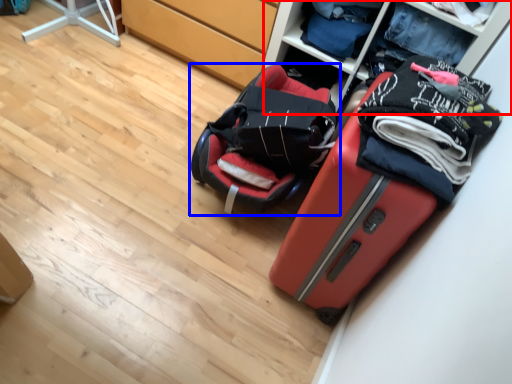
Question: Which point is closer to the camera, shelf (highlighted by a red box) or luggage and bags (highlighted by a blue box)?

Choices:
 (A) shelf
 (B) luggage and bags

Answer: (B)